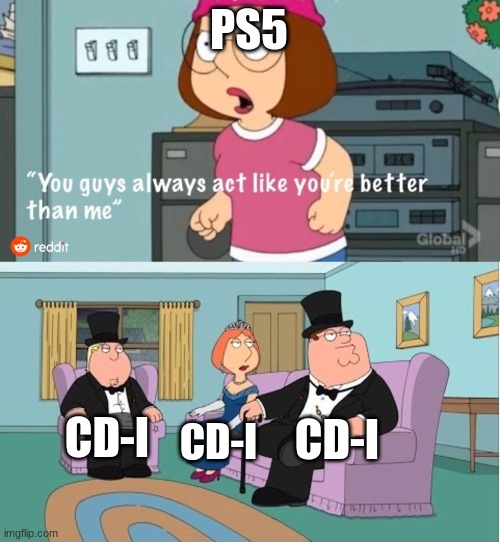
I want to click on light switch, so [121, 57].